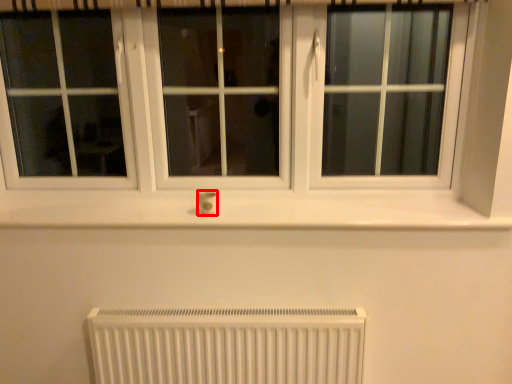
Question: Observing the image, what is the correct spatial positioning of electric outlet (annotated by the red box) in reference to radiator?

Choices:
 (A) left
 (B) right

Answer: (A)